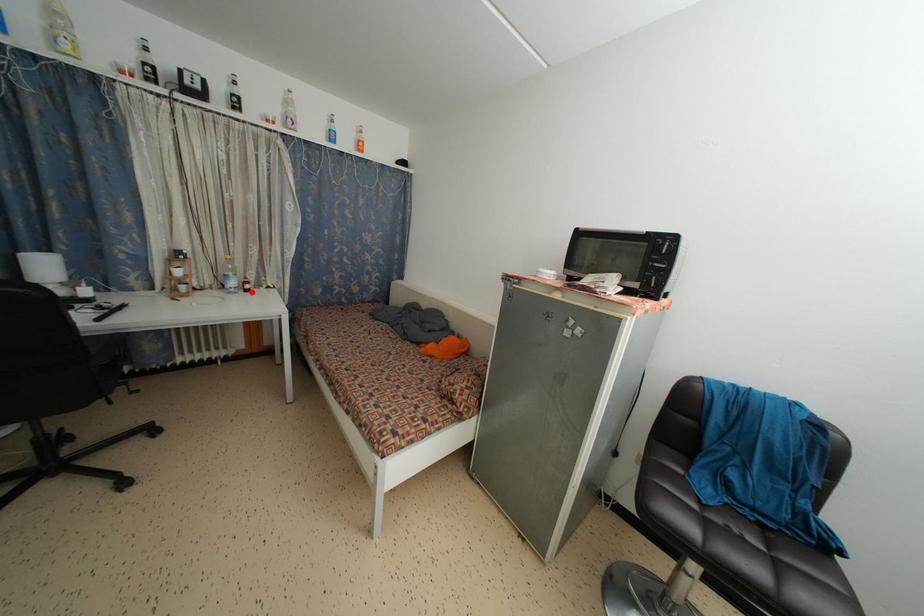
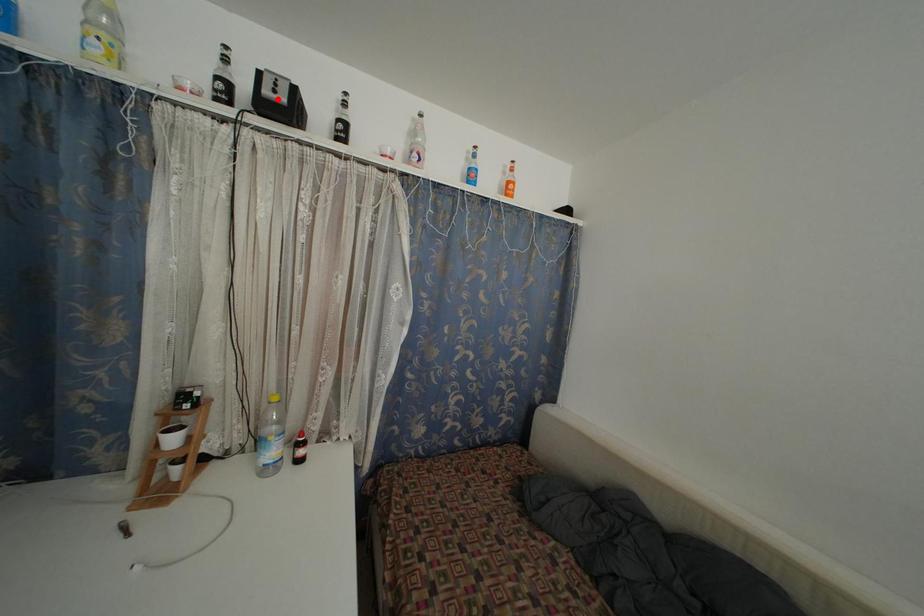
I am providing you with two images of the same scene from different viewpoints. A red point is marked on the first image and another point is marked on the second image. Is the red point in image1 aligned with the point shown in image2?

No